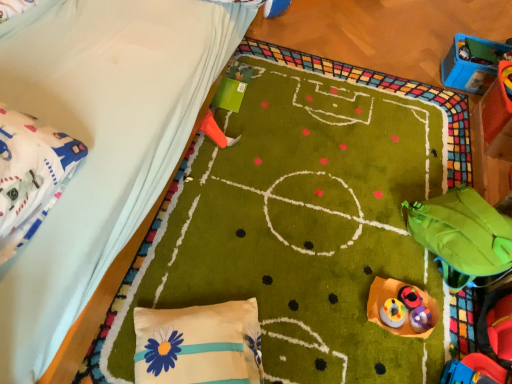
Question: Could rubberized plastic toy at center, the third toy positioned from the top, be considered to be inside blue plastic toy at upper right, which ranks as the sixth toy in bottom-to-top order?

Choices:
 (A) no
 (B) yes

Answer: (A)

Question: Is the depth of blue plastic toy at upper right, acting as the sixth toy starting from the front, less than that of rubberized plastic toy at center, placed as the 3th toy when sorted from right to left?

Choices:
 (A) yes
 (B) no

Answer: (B)

Question: From the image's perspective, would you say blue plastic toy at upper right, which ranks as the sixth toy in bottom-to-top order, is positioned over rubberized plastic toy at center, placed as the fourth toy when sorted from bottom to top?

Choices:
 (A) no
 (B) yes

Answer: (B)

Question: Is blue plastic toy at upper right, acting as the sixth toy starting from the front, wider than rubberized plastic toy at center, placed as the 3th toy when sorted from right to left?

Choices:
 (A) no
 (B) yes

Answer: (B)

Question: From a real-world perspective, is blue plastic toy at upper right, which ranks as the sixth toy in bottom-to-top order, under rubberized plastic toy at center, placed as the fourth toy when sorted from bottom to top?

Choices:
 (A) yes
 (B) no

Answer: (B)

Question: Is point (409, 289) positioned closer to the camera than point (428, 311)?

Choices:
 (A) farther
 (B) closer

Answer: (A)

Question: From the image's perspective, is rubberized plastic toy at center, placed as the 3th toy when sorted from right to left, positioned above or below rubberized plastic toy at lower right, placed as the 2th toy when sorted from right to left?

Choices:
 (A) below
 (B) above

Answer: (B)

Question: Relative to rubberized plastic toy at lower right, the 1th toy when ordered from bottom to top, is rubberized plastic toy at center, placed as the 3th toy when sorted from right to left, in front or behind?

Choices:
 (A) behind
 (B) front

Answer: (A)

Question: Considering the positions of rubberized plastic toy at center, the third toy positioned from the top, and rubberized plastic toy at lower right, positioned as the fifth toy in left-to-right order, in the image, is rubberized plastic toy at center, the third toy positioned from the top, bigger or smaller than rubberized plastic toy at lower right, positioned as the fifth toy in left-to-right order,?

Choices:
 (A) big
 (B) small

Answer: (B)

Question: In the image, is rubberized plastic toy at center, the third toy positioned from the top, on the left side or the right side of green fabric bean bag at lower right?

Choices:
 (A) right
 (B) left

Answer: (B)

Question: Based on their sizes in the image, would you say rubberized plastic toy at center, the fourth toy in the front-to-back sequence, is bigger or smaller than green fabric bean bag at lower right?

Choices:
 (A) small
 (B) big

Answer: (A)

Question: Is point (408, 289) closer or farther from the camera than point (471, 246)?

Choices:
 (A) farther
 (B) closer

Answer: (A)

Question: From a real-world perspective, is rubberized plastic toy at center, the fourth toy in the front-to-back sequence, positioned above or below green fabric bean bag at lower right?

Choices:
 (A) below
 (B) above

Answer: (A)

Question: Relative to matte plastic toy at lower right, which appears as the 1th toy when viewed from the front, is rubberized plastic toy at lower right, the 1th toy when ordered from bottom to top, in front or behind?

Choices:
 (A) behind
 (B) front

Answer: (A)

Question: In terms of height, does rubberized plastic toy at lower right, the 1th toy when ordered from bottom to top, look taller or shorter compared to matte plastic toy at lower right, the 6th toy from the back?

Choices:
 (A) tall
 (B) short

Answer: (B)